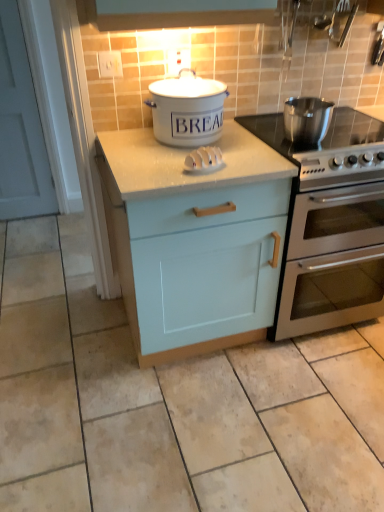
Question: Is there a large distance between stainless steel oven at right and white plastic knife block at center?

Choices:
 (A) yes
 (B) no

Answer: (B)

Question: Is stainless steel oven at right looking in the opposite direction of white plastic knife block at center?

Choices:
 (A) yes
 (B) no

Answer: (B)

Question: Can you confirm if stainless steel oven at right is taller than white plastic knife block at center?

Choices:
 (A) yes
 (B) no

Answer: (A)

Question: Is stainless steel oven at right aimed at white plastic knife block at center?

Choices:
 (A) no
 (B) yes

Answer: (A)

Question: Can you confirm if stainless steel oven at right is wider than white plastic knife block at center?

Choices:
 (A) yes
 (B) no

Answer: (A)

Question: In terms of height, does white ceramic bread bin at center, acting as the 1th kitchen appliance starting from the left, look taller or shorter compared to polished stainless steel pot at right, the 1th kitchen appliance when ordered from right to left?

Choices:
 (A) tall
 (B) short

Answer: (A)

Question: Considering the relative positions of white ceramic bread bin at center, acting as the 2th kitchen appliance starting from the right, and polished stainless steel pot at right, acting as the second kitchen appliance starting from the left, in the image provided, is white ceramic bread bin at center, acting as the 2th kitchen appliance starting from the right, to the left or to the right of polished stainless steel pot at right, acting as the second kitchen appliance starting from the left,?

Choices:
 (A) right
 (B) left

Answer: (B)

Question: Based on their sizes in the image, would you say white ceramic bread bin at center, acting as the 2th kitchen appliance starting from the right, is bigger or smaller than polished stainless steel pot at right, acting as the second kitchen appliance starting from the left?

Choices:
 (A) big
 (B) small

Answer: (A)

Question: Which is correct: white ceramic bread bin at center, acting as the 1th kitchen appliance starting from the left, is inside polished stainless steel pot at right, the 1th kitchen appliance when ordered from right to left, or outside of it?

Choices:
 (A) outside
 (B) inside

Answer: (A)

Question: In terms of size, does stainless steel gas stove at right appear bigger or smaller than light blue wood cabinet at center?

Choices:
 (A) small
 (B) big

Answer: (A)

Question: Which is correct: stainless steel gas stove at right is inside light blue wood cabinet at center, or outside of it?

Choices:
 (A) inside
 (B) outside

Answer: (B)

Question: Relative to light blue wood cabinet at center, is stainless steel gas stove at right in front or behind?

Choices:
 (A) front
 (B) behind

Answer: (B)

Question: From their relative heights in the image, would you say stainless steel gas stove at right is taller or shorter than light blue wood cabinet at center?

Choices:
 (A) tall
 (B) short

Answer: (B)

Question: From a real-world perspective, is white plastic knife block at center positioned above or below light blue wood cabinet at center?

Choices:
 (A) below
 (B) above

Answer: (B)

Question: Is white plastic knife block at center to the left or to the right of light blue wood cabinet at center in the image?

Choices:
 (A) left
 (B) right

Answer: (B)